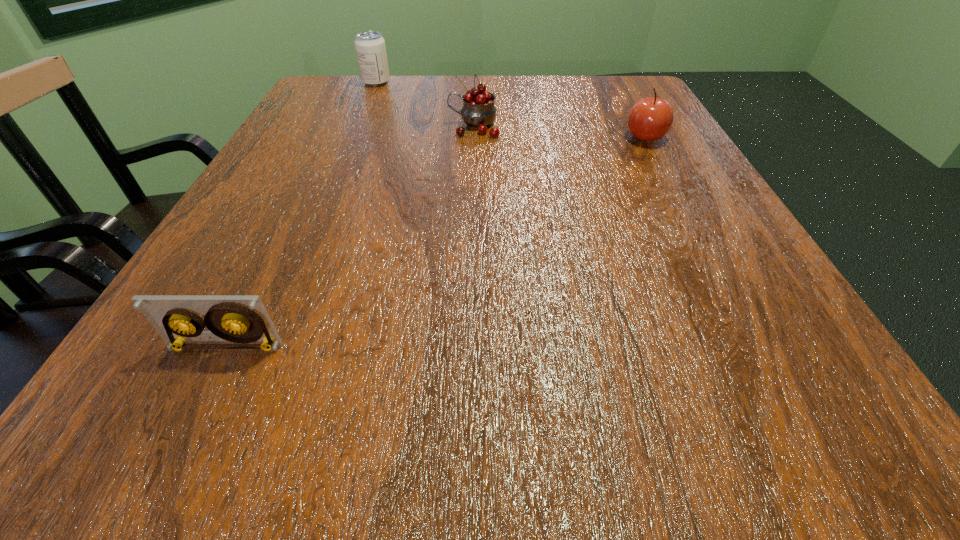
At what (x,y) coordinates should I click in order to perform the action: click on soda can present at the far edge. Please return your answer as a coordinate pair (x, y). The height and width of the screenshot is (540, 960). Looking at the image, I should click on (370, 47).

Locate an element on the screen. cherry that is at the far edge is located at coordinates (478, 111).

Where is `soda can that is at the left edge`? The height and width of the screenshot is (540, 960). soda can that is at the left edge is located at coordinates (370, 47).

Locate an element on the screen. Image resolution: width=960 pixels, height=540 pixels. videotape at the left edge is located at coordinates (243, 319).

Image resolution: width=960 pixels, height=540 pixels. What are the coordinates of `object that is at the right edge` in the screenshot? It's located at (649, 119).

Identify the location of object at the far left corner. The width and height of the screenshot is (960, 540). 370,47.

This screenshot has height=540, width=960. In the image, there is a desktop. Identify the location of free region at the far edge. (574, 89).

Identify the location of vacant space at the near edge of the desktop. Image resolution: width=960 pixels, height=540 pixels. (458, 440).

Image resolution: width=960 pixels, height=540 pixels. Identify the location of free point at the left edge. (267, 165).

Identify the location of vacant space at the right edge of the desktop. (718, 238).